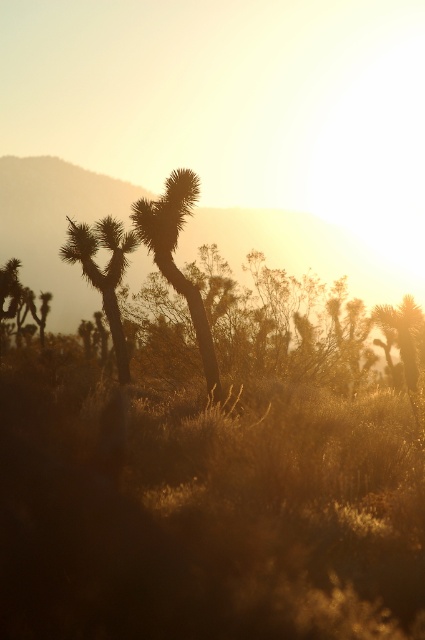
Between point (163, 218) and point (124, 352), which one is positioned in front?

Point (163, 218) is more forward.

Is brown spiky cactus at center thinner than silhouetted spiky cactus at center?

Yes, brown spiky cactus at center is thinner than silhouetted spiky cactus at center.

Locate an element on the screen. Image resolution: width=425 pixels, height=640 pixels. brown spiky cactus at center is located at coordinates (172, 259).